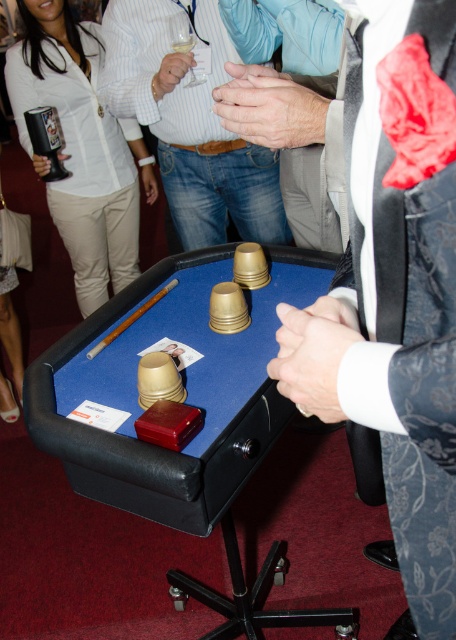
Does dark gray textured suit at center lie in front of smooth skin hands at center?

That is True.

How far apart are dark gray textured suit at center and smooth skin hands at center?

A distance of 32.01 centimeters exists between dark gray textured suit at center and smooth skin hands at center.

Locate an element on the screen. Image resolution: width=456 pixels, height=640 pixels. dark gray textured suit at center is located at coordinates (413, 307).

Who is higher up, blue felt billiard table at center or brushed metal mug at upper left?

brushed metal mug at upper left is higher up.

Consider the image. Does blue felt billiard table at center lie in front of brushed metal mug at upper left?

Yes, it is in front of brushed metal mug at upper left.

You are a GUI agent. You are given a task and a screenshot of the screen. Output one action in this format:
    pyautogui.click(x=<x>, y=<y>)
    Task: Click on the blue felt billiard table at center
    This screenshot has height=640, width=456.
    Given the screenshot: What is the action you would take?
    pyautogui.click(x=192, y=408)

Who is higher up, blue felt billiard table at center or matte brown hand at center?

matte brown hand at center is higher up.

Who is more distant from viewer, (228, 353) or (176, 77)?

Positioned behind is point (176, 77).

Who is more forward, (98, 356) or (179, 81)?

Positioned in front is point (98, 356).

This screenshot has height=640, width=456. Find the location of `blue felt billiard table at center`. blue felt billiard table at center is located at coordinates (192, 408).